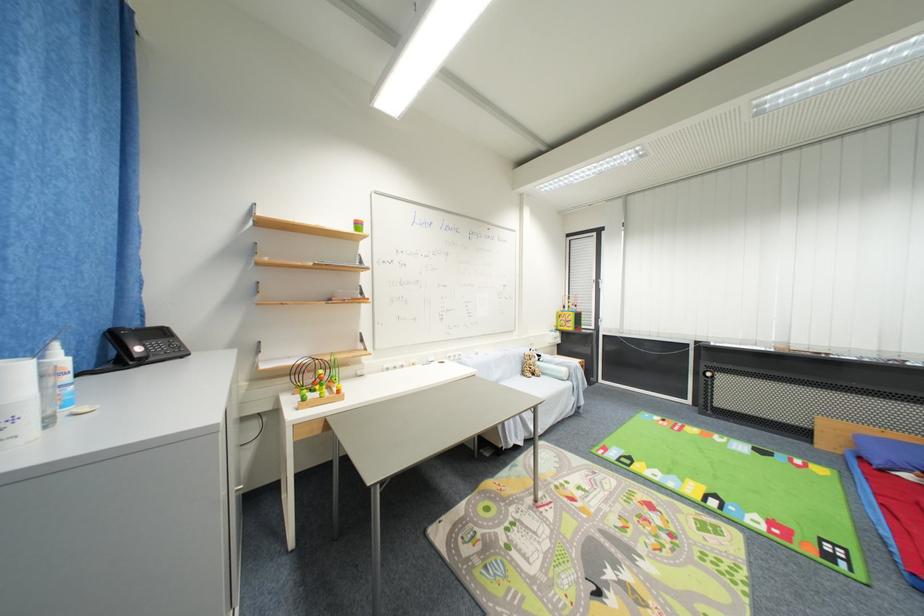
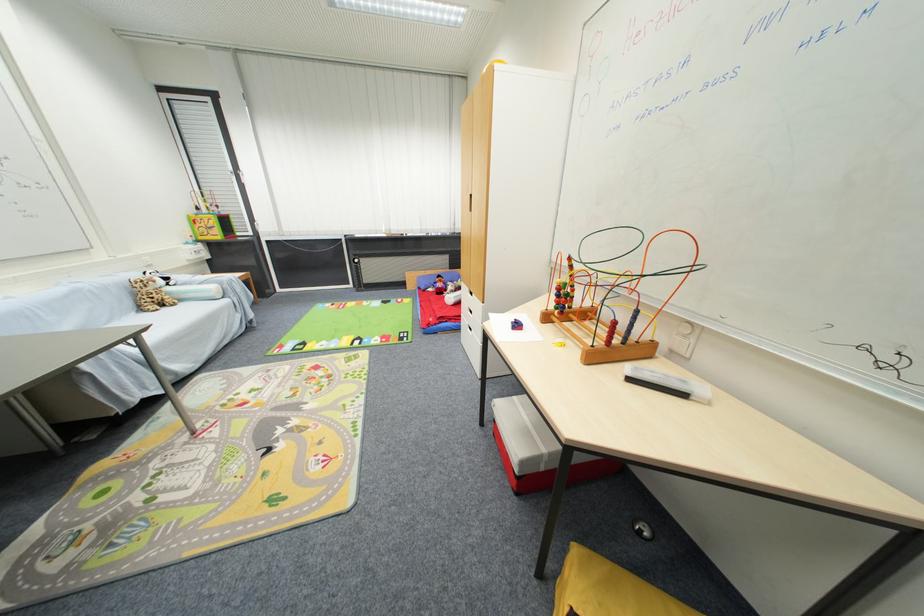
In the second image, find the point that corresponds to point (540, 379) in the first image.

(171, 310)